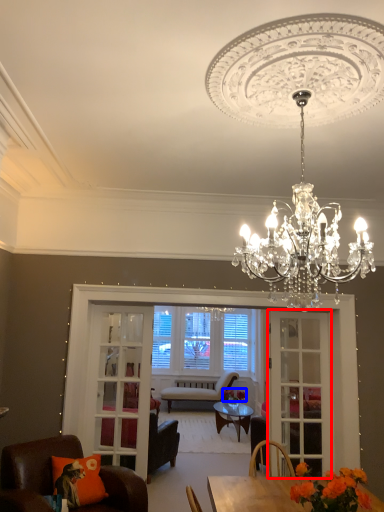
Question: Among these objects, which one is farthest to the camera, screen door (highlighted by a red box) or flower (highlighted by a blue box)?

Choices:
 (A) screen door
 (B) flower

Answer: (B)